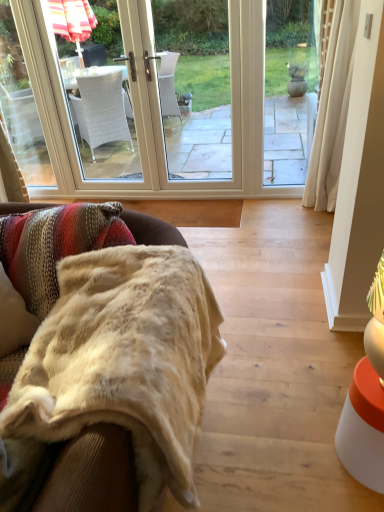
This screenshot has height=512, width=384. Find the location of `beige plush blanket at lower left`. beige plush blanket at lower left is located at coordinates (93, 473).

What do you see at coordinates (93, 473) in the screenshot? I see `beige plush blanket at lower left` at bounding box center [93, 473].

The height and width of the screenshot is (512, 384). I want to click on beige plush blanket at lower left, so [x=93, y=473].